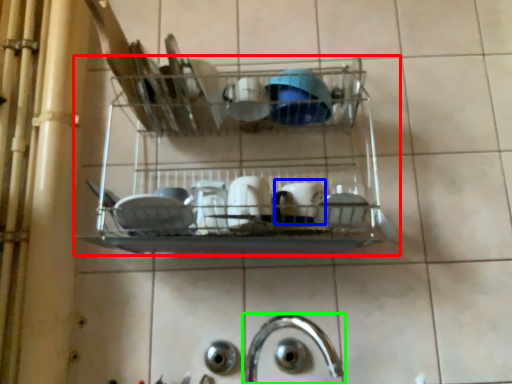
Question: Which object is positioned farthest from shelf (highlighted by a red box)? Select from tableware (highlighted by a blue box) and tap (highlighted by a green box).

Choices:
 (A) tableware
 (B) tap

Answer: (B)